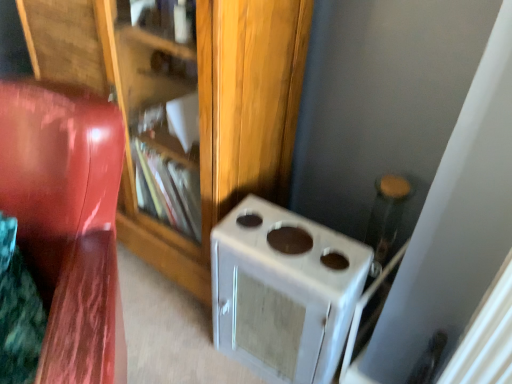
Question: Can glossy wood chair at left be found inside white matte stove at lower right?

Choices:
 (A) no
 (B) yes

Answer: (A)

Question: From a real-world perspective, is white matte stove at lower right below glossy wood chair at left?

Choices:
 (A) no
 (B) yes

Answer: (B)

Question: Is white matte stove at lower right facing towards glossy wood chair at left?

Choices:
 (A) no
 (B) yes

Answer: (B)

Question: Considering the relative sizes of white matte stove at lower right and glossy wood chair at left in the image provided, is white matte stove at lower right shorter than glossy wood chair at left?

Choices:
 (A) no
 (B) yes

Answer: (B)

Question: From the image's perspective, is white matte stove at lower right beneath glossy wood chair at left?

Choices:
 (A) no
 (B) yes

Answer: (B)

Question: Can you confirm if white matte stove at lower right is bigger than glossy wood chair at left?

Choices:
 (A) yes
 (B) no

Answer: (B)

Question: Considering the relative sizes of wooden bookshelf at center and white matte stove at lower right in the image provided, is wooden bookshelf at center taller than white matte stove at lower right?

Choices:
 (A) no
 (B) yes

Answer: (B)

Question: Does wooden bookshelf at center have a smaller size compared to white matte stove at lower right?

Choices:
 (A) yes
 (B) no

Answer: (B)

Question: Is wooden bookshelf at center positioned with its back to white matte stove at lower right?

Choices:
 (A) yes
 (B) no

Answer: (B)

Question: Can you see wooden bookshelf at center touching white matte stove at lower right?

Choices:
 (A) no
 (B) yes

Answer: (A)

Question: From a real-world perspective, is wooden bookshelf at center beneath white matte stove at lower right?

Choices:
 (A) no
 (B) yes

Answer: (A)

Question: From the image's perspective, would you say wooden bookshelf at center is positioned over white matte stove at lower right?

Choices:
 (A) yes
 (B) no

Answer: (A)

Question: Would you say wooden bookshelf at center is a long distance from glossy wood chair at left?

Choices:
 (A) no
 (B) yes

Answer: (A)